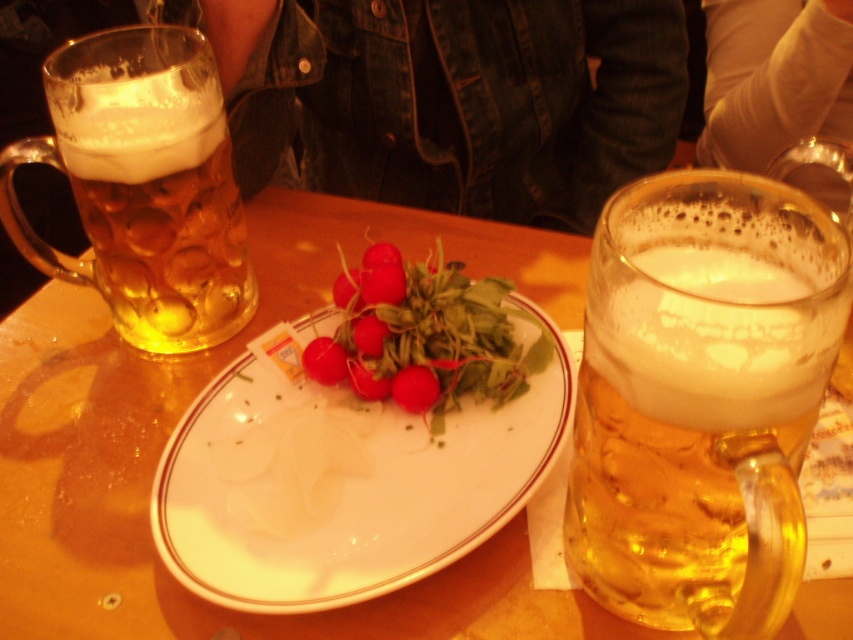
You are a server at a pub and need to place a new order of radishes on the table. The radishes come in a small basket. Which object, the translucent glass mug at center or the white ceramic plate at center, should you place the basket next to to ensure it doesn???t block the view of the other items on the table?

The translucent glass mug at center is thinner than the white ceramic plate at center, so placing the basket next to the translucent glass mug at center would block less space and maintain a clear view of the other items on the table.

You are a customer sitting at the table in the dining scene. You notice two points marked on the table surface. Which point is closer to you, point at coordinate (x=564, y=413) or point at coordinate (x=202, y=77)?

Point at coordinate (x=564, y=413) is closer to you than point at coordinate (x=202, y=77).